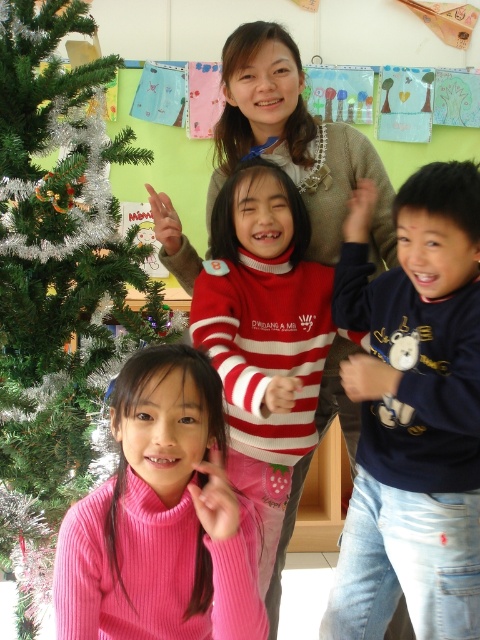
From the picture: Between green tinsel christmas tree at left and pink ribbed sweater at center, which one is positioned higher?

green tinsel christmas tree at left

Locate an element on the screen. The width and height of the screenshot is (480, 640). green tinsel christmas tree at left is located at coordinates (57, 266).

Image resolution: width=480 pixels, height=640 pixels. In order to click on green tinsel christmas tree at left in this screenshot , I will do `click(57, 266)`.

Identify the location of green tinsel christmas tree at left. (57, 266).

Is dark blue cotton shirt at right to the left of pink ribbed sweater at center from the viewer's perspective?

Incorrect, dark blue cotton shirt at right is not on the left side of pink ribbed sweater at center.

Is dark blue cotton shirt at right wider than pink ribbed sweater at center?

Incorrect, dark blue cotton shirt at right's width does not surpass pink ribbed sweater at center's.

Locate an element on the screen. dark blue cotton shirt at right is located at coordinates (414, 413).

How distant is dark blue cotton shirt at right from green tinsel christmas tree at left?

27.47 inches

Consider the image. Can you confirm if dark blue cotton shirt at right is taller than green tinsel christmas tree at left?

Incorrect, dark blue cotton shirt at right's height is not larger of green tinsel christmas tree at left's.

Which is behind, point (467, 380) or point (95, 173)?

The point (95, 173) is behind.

This screenshot has height=640, width=480. I want to click on dark blue cotton shirt at right, so click(414, 413).